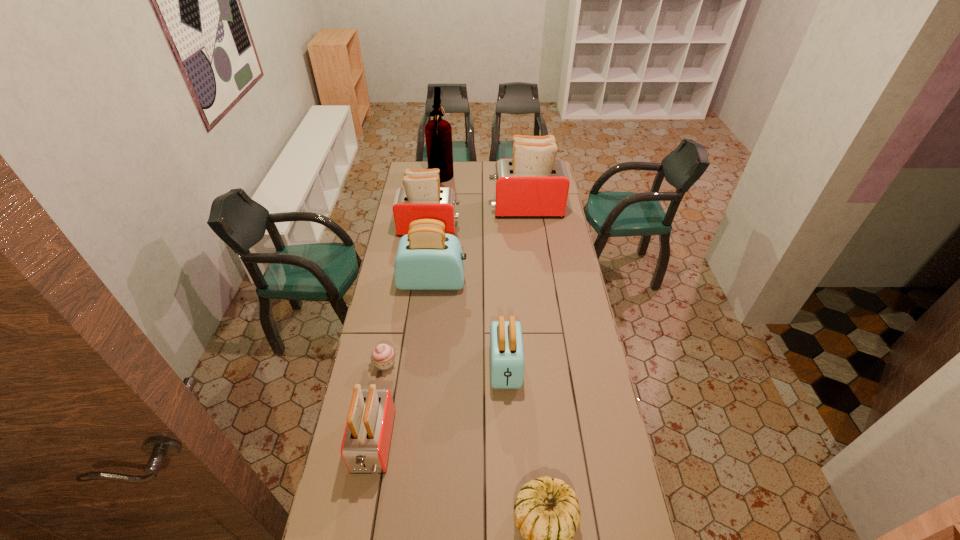
Locate an element on the screen. the nearest toaster is located at coordinates (365, 447).

At what (x,y) coordinates should I click in order to perform the action: click on pink cupcake. Please return your answer as a coordinate pair (x, y). Looking at the image, I should click on (383, 355).

I want to click on cupcake, so click(x=383, y=355).

Locate an element on the screen. free space located 0.060m at the nozzle of the red fire extinguisher is located at coordinates (463, 181).

Image resolution: width=960 pixels, height=540 pixels. Find the location of `free location located on the front-facing side of the tallest toaster`. free location located on the front-facing side of the tallest toaster is located at coordinates (464, 209).

You are a GUI agent. You are given a task and a screenshot of the screen. Output one action in this format:
    pyautogui.click(x=<x>, y=<y>)
    Task: Click on the free spot located on the front-facing side of the tallest toaster
    Image resolution: width=960 pixels, height=540 pixels.
    Given the screenshot: What is the action you would take?
    pyautogui.click(x=439, y=209)

The width and height of the screenshot is (960, 540). I want to click on blank space located on the front-facing side of the tallest toaster, so click(x=448, y=209).

Find the location of a particular element. free location located 0.370m on the side of the bigger light toaster with the lever is located at coordinates (546, 281).

Locate an element on the screen. The width and height of the screenshot is (960, 540). free space located on the front-facing side of the second smallest red toaster is located at coordinates (491, 228).

Identify the location of free space located on the side of the smaller light toaster with the lever. (510, 453).